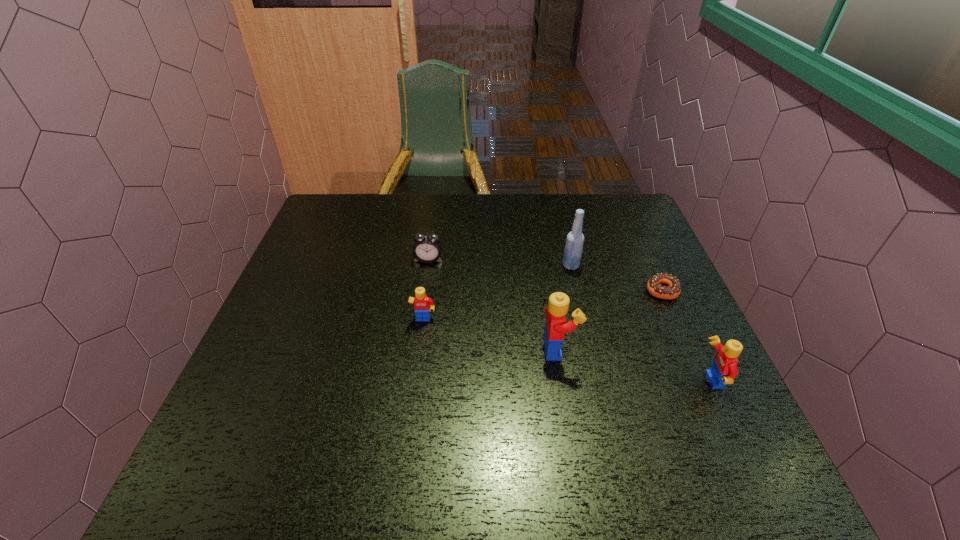
I want to click on the shortest Lego, so click(x=421, y=302).

The height and width of the screenshot is (540, 960). Find the location of `the farthest Lego`. the farthest Lego is located at coordinates (421, 302).

Image resolution: width=960 pixels, height=540 pixels. What are the coordinates of `the fourth object from right to left` in the screenshot? It's located at (556, 327).

In order to click on the second Lego from left to right in this screenshot , I will do `click(556, 327)`.

At what (x,y) coordinates should I click in order to perform the action: click on the third tallest object. Please return your answer as a coordinate pair (x, y). The height and width of the screenshot is (540, 960). Looking at the image, I should click on pos(724,369).

Identify the location of the rightmost Lego. (724, 369).

Locate an element on the screen. Image resolution: width=960 pixels, height=540 pixels. the third object from right to left is located at coordinates (575, 239).

Where is `alarm clock`? Image resolution: width=960 pixels, height=540 pixels. alarm clock is located at coordinates (427, 248).

This screenshot has width=960, height=540. What are the coordinates of `the shortest object` in the screenshot? It's located at (673, 290).

The height and width of the screenshot is (540, 960). What are the coordinates of `doughnut` in the screenshot? It's located at pyautogui.click(x=673, y=290).